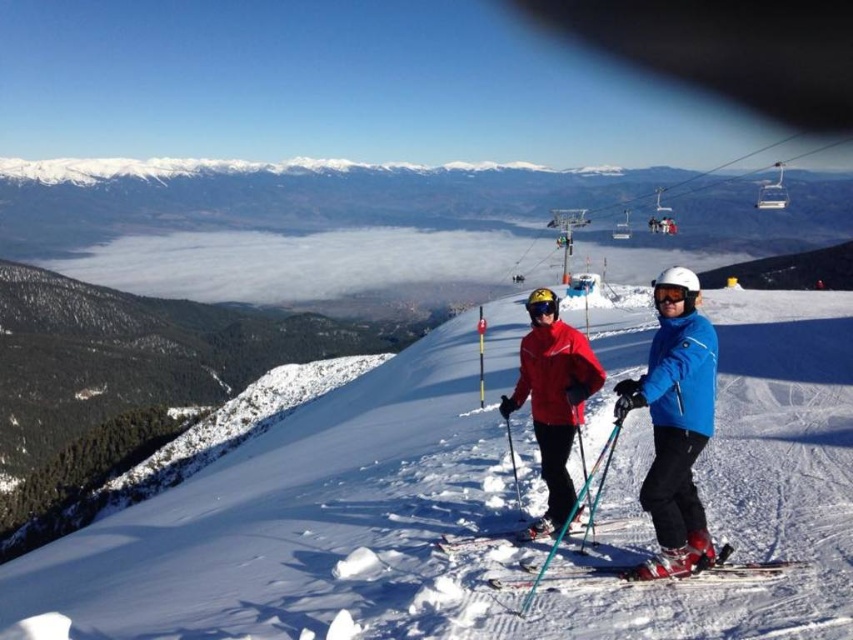
You are a photographer standing at the bottom of the slope. You want to take a photo of the blue matte ski jacket at right. Where should you aim your camera to capture it in the frame?

You should aim your camera at the 2D location point (675, 428) to capture the blue matte ski jacket at right in the frame.

You are standing on the snow slope and want to reach the point that is closer to you. Which point should you head towards, point (x=434, y=634) or point (x=660, y=387)?

You should head towards point (x=434, y=634) because it is closer to the viewer than point (x=660, y=387).

You are a photographer trying to capture a photo of both the blue matte ski jacket at right and the black matte goggles at center. Since you want both objects in focus, you need to adjust your camera settings. Which object should you focus on to ensure both are in focus?

The blue matte ski jacket at right is much taller than the black matte goggles at center. To ensure both are in focus, you should focus on the blue matte ski jacket at right since it is farther away, allowing the depth of field to cover both objects.